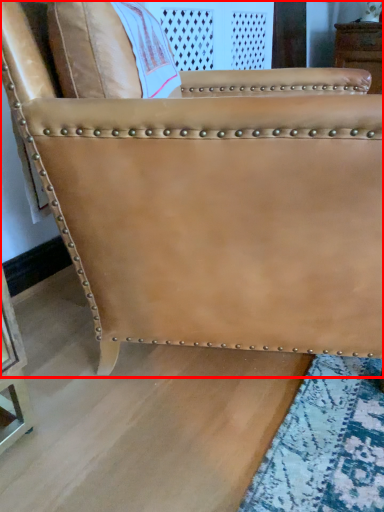
Question: From the image's perspective, considering the relative positions of chair (annotated by the red box) and furniture in the image provided, where is chair (annotated by the red box) located with respect to the staircase?

Choices:
 (A) below
 (B) above

Answer: (A)